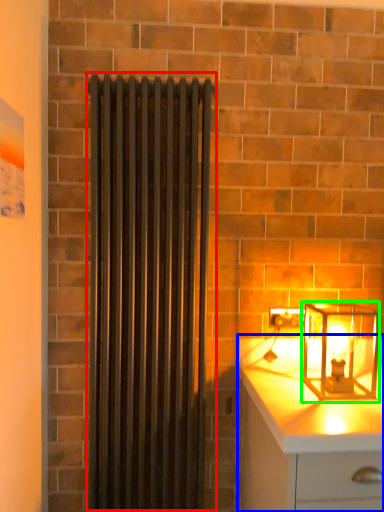
Question: Considering the real-world distances, which object is farthest from shower curtain (highlighted by a red box)? chest of drawers (highlighted by a blue box) or lamp (highlighted by a green box)?

Choices:
 (A) chest of drawers
 (B) lamp

Answer: (B)